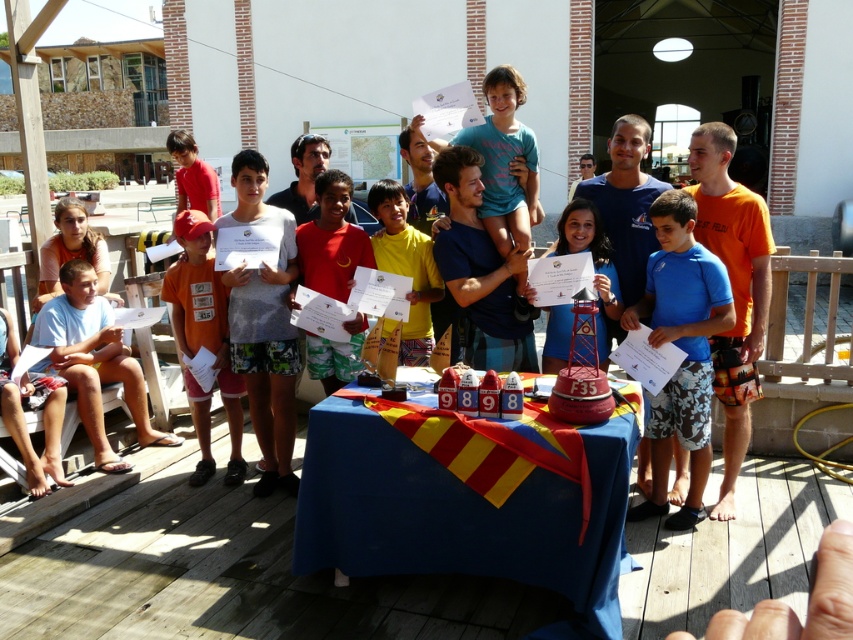
Question: Does matte orange t-shirt at center appear on the left side of yellow matte shirt at center?

Choices:
 (A) no
 (B) yes

Answer: (B)

Question: Among these objects, which one is nearest to the camera?

Choices:
 (A) blue fabric at center
 (B) red cotton shirt at center
 (C) blue floral shorts at center
 (D) yellow matte shirt at center

Answer: (A)

Question: Which object is positioned closest to the blue fabric at center?

Choices:
 (A) red cotton shirt at center
 (B) blue floral shorts at center

Answer: (B)

Question: Considering the relative positions of yellow matte shirt at center and matte blue shirt at center in the image provided, where is yellow matte shirt at center located with respect to matte blue shirt at center?

Choices:
 (A) right
 (B) left

Answer: (B)

Question: Estimate the real-world distances between objects in this image. Which object is farther from the blue floral shorts at center?

Choices:
 (A) matte blue shirt at center
 (B) yellow matte shirt at center

Answer: (B)

Question: Is yellow matte shirt at center behind matte blue shirt at center?

Choices:
 (A) no
 (B) yes

Answer: (A)